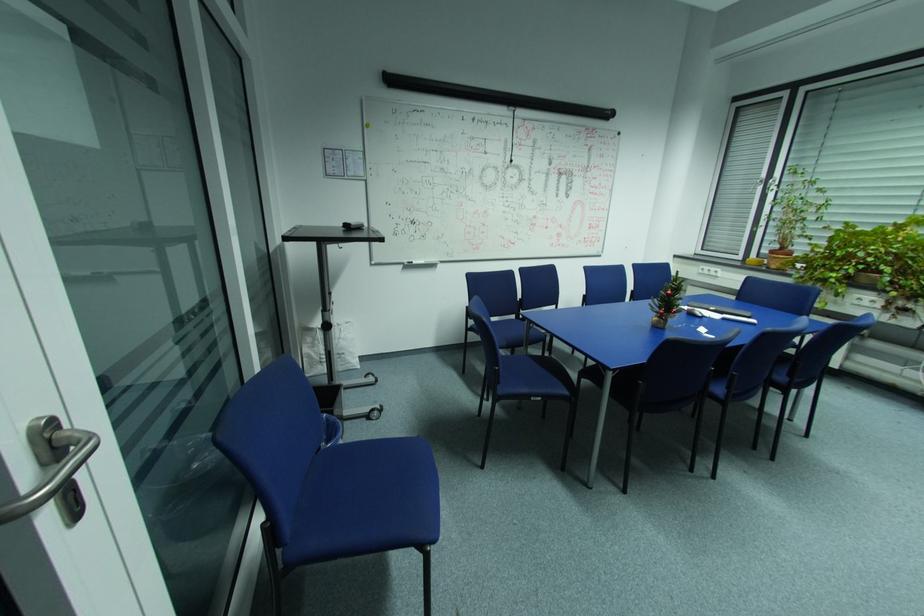
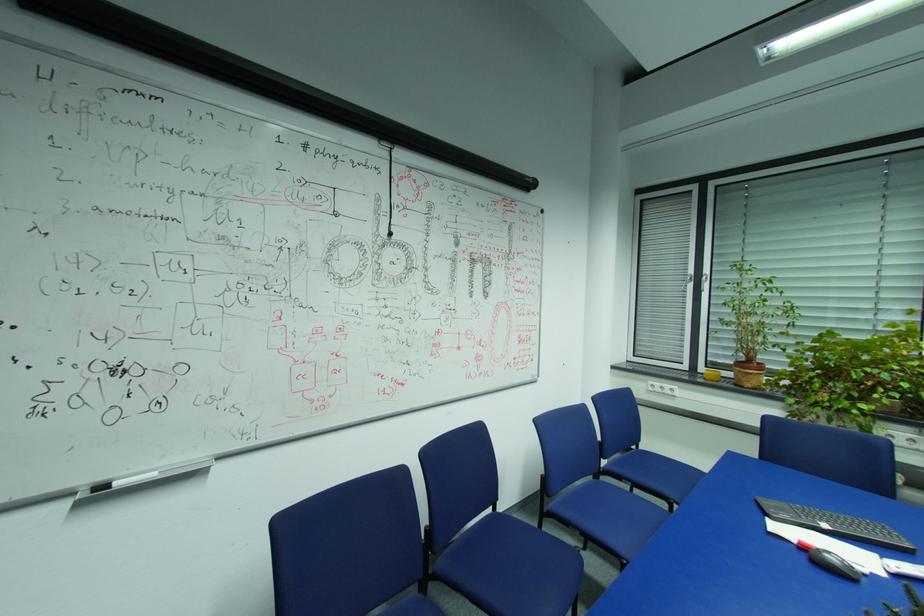
Question: What movement of the cameraman would produce the second image?

Choices:
 (A) Left
 (B) Right
 (C) Forward
 (D) Backward

Answer: (C)